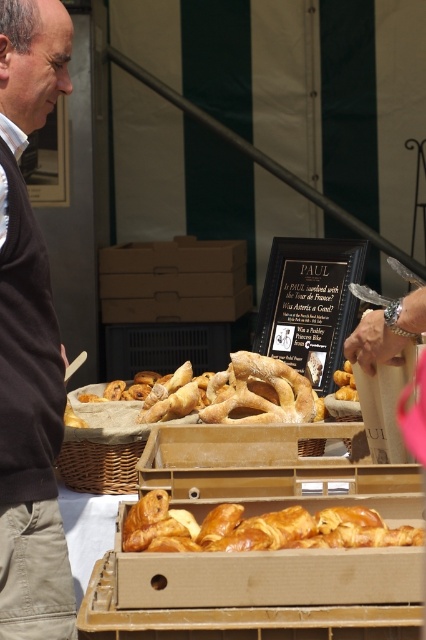
Which of these two, brown sweater at left or golden brown flaky croissant at center, stands shorter?

golden brown flaky croissant at center

Which is more to the left, brown sweater at left or golden brown flaky croissant at center?

From the viewer's perspective, brown sweater at left appears more on the left side.

Which is in front, point (20, 35) or point (184, 512)?

Point (184, 512)

At what (x,y) coordinates should I click in order to perform the action: click on brown sweater at left. Please return your answer as a coordinate pair (x, y). Looking at the image, I should click on (29, 339).